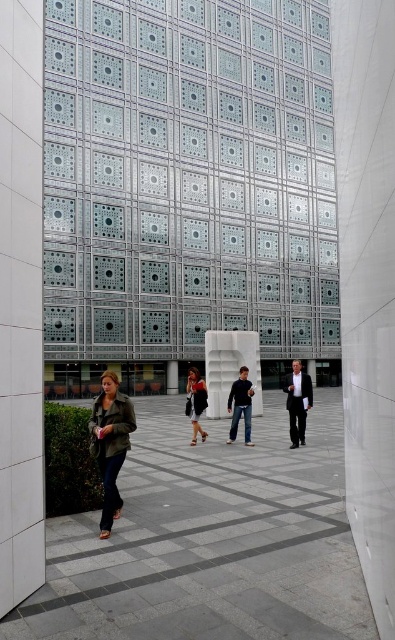
Question: In this image, where is dark gray suit at center located relative to black leather jacket at center?

Choices:
 (A) above
 (B) below

Answer: (B)

Question: Which point is farther to the camera?

Choices:
 (A) (295, 412)
 (B) (122, 397)
 (C) (193, 371)

Answer: (C)

Question: Considering the relative positions of green matte jacket at lower left and black leather jacket at center in the image provided, where is green matte jacket at lower left located with respect to black leather jacket at center?

Choices:
 (A) above
 (B) below

Answer: (A)

Question: Estimate the real-world distances between objects in this image. Which object is closer to the green matte jacket at lower left?

Choices:
 (A) dark gray suit at center
 (B) dark blue jeans at center
 (C) white marble pillar at center
 (D) black leather jacket at center

Answer: (B)

Question: Considering the relative positions of green matte jacket at lower left and black leather jacket at center in the image provided, where is green matte jacket at lower left located with respect to black leather jacket at center?

Choices:
 (A) left
 (B) right

Answer: (A)

Question: Which point appears closest to the camera in this image?

Choices:
 (A) (114, 381)
 (B) (291, 448)
 (C) (201, 390)
 (D) (244, 412)

Answer: (A)